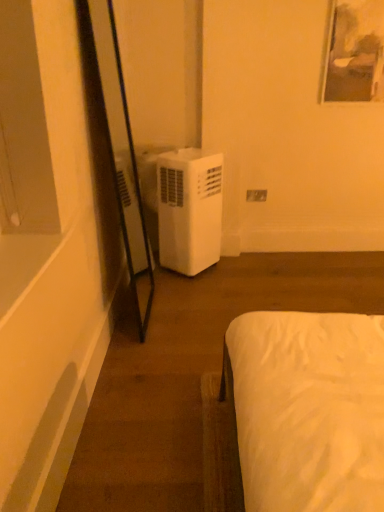
Question: Considering the positions of white plastic electric outlet at center and white plastic air conditioner at left in the image, is white plastic electric outlet at center bigger or smaller than white plastic air conditioner at left?

Choices:
 (A) big
 (B) small

Answer: (B)

Question: Is white plastic electric outlet at center spatially inside white plastic air conditioner at left, or outside of it?

Choices:
 (A) inside
 (B) outside

Answer: (B)

Question: In the image, is white plastic electric outlet at center positioned in front of or behind white plastic air conditioner at left?

Choices:
 (A) behind
 (B) front

Answer: (A)

Question: Does point (167, 200) appear closer or farther from the camera than point (251, 188)?

Choices:
 (A) closer
 (B) farther

Answer: (A)

Question: Which is correct: white plastic air conditioner at left is inside white plastic electric outlet at center, or outside of it?

Choices:
 (A) inside
 (B) outside

Answer: (B)

Question: Is white plastic air conditioner at left wider or thinner than white plastic electric outlet at center?

Choices:
 (A) thin
 (B) wide

Answer: (B)

Question: Based on their sizes in the image, would you say white plastic air conditioner at left is bigger or smaller than white plastic electric outlet at center?

Choices:
 (A) big
 (B) small

Answer: (A)